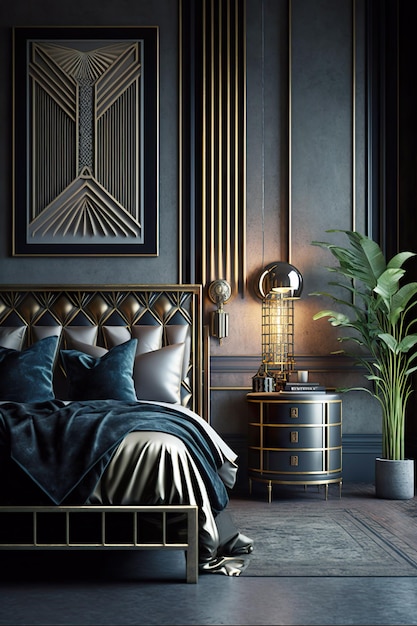
Identify the location of bedroom. [x=230, y=409].